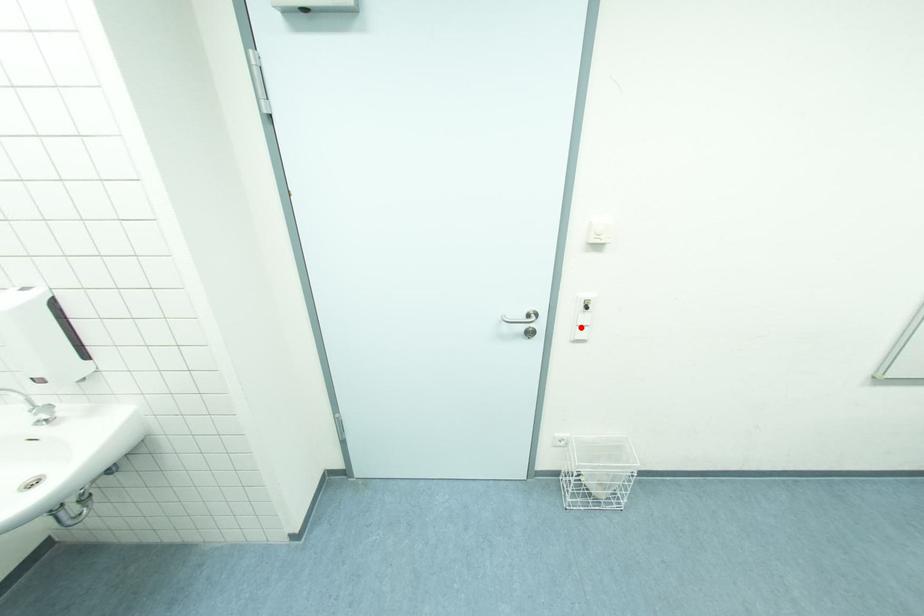
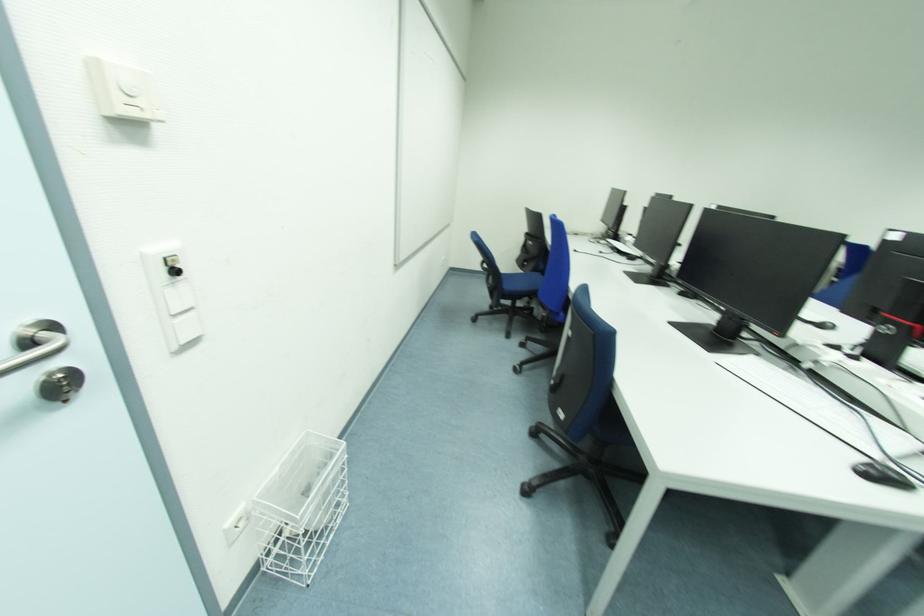
In the second image, find the point that corresponds to the highlighted location in the first image.

(177, 317)